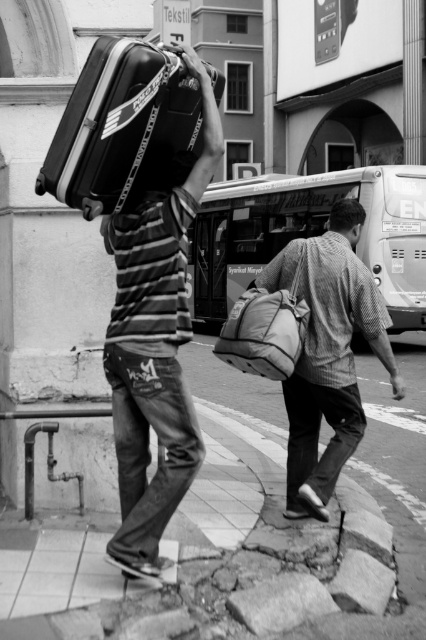
You are a delivery drone flying above the city street scene. You need to land on the smooth concrete pavement at lower center to deliver a package. However, there is a textured canvas backpack at center in the way. Based on the scene description, can you safely land on the pavement without hitting the backpack?

The smooth concrete pavement at lower center is closer to the viewer than the textured canvas backpack at center, meaning the backpack is further away from the drone. Since the backpack is behind the pavement, the drone can safely land on the pavement without obstruction from the backpack.

You are a delivery person who needs to hand over the matte black suitcase at upper left to the recipient. You are currently standing 3 meters away from it. Can you reach it without moving closer?

The matte black suitcase at upper left is 3.81 meters away from the viewer, so you are currently 3 meters away from it. Since 3 meters is less than 3.81 meters, you are closer than the required distance. Therefore, you can reach it without moving closer.